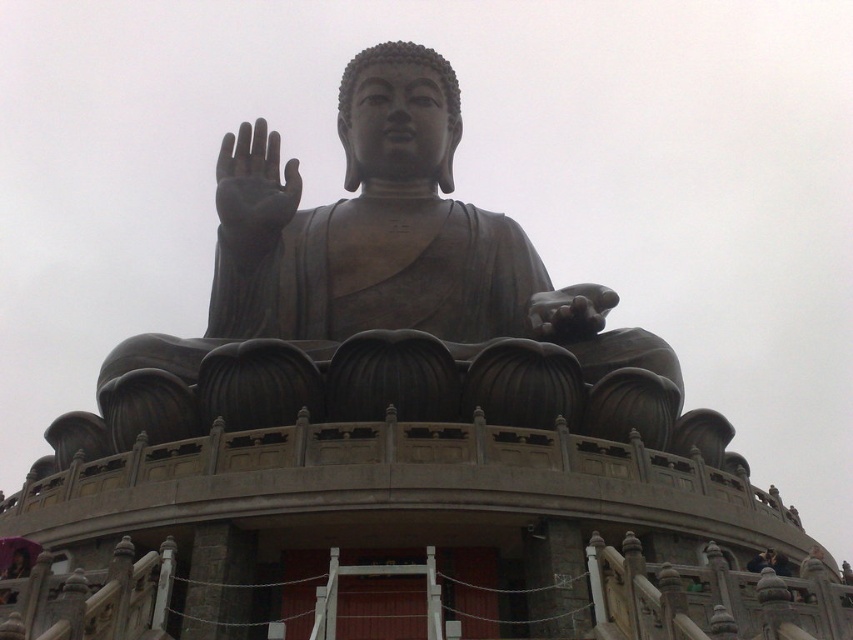
Question: Which point appears farthest from the camera in this image?

Choices:
 (A) pos(242,232)
 (B) pos(451,289)

Answer: (A)

Question: Can you confirm if bronze statue at center is wider than black matte hand at upper center?

Choices:
 (A) yes
 (B) no

Answer: (A)

Question: Is bronze statue at center closer to the viewer compared to black matte hand at upper center?

Choices:
 (A) yes
 (B) no

Answer: (A)

Question: Can you confirm if bronze statue at center is smaller than black matte hand at upper center?

Choices:
 (A) yes
 (B) no

Answer: (B)

Question: Which of the following is the closest to the observer?

Choices:
 (A) black matte hand at upper center
 (B) bronze statue at center

Answer: (B)